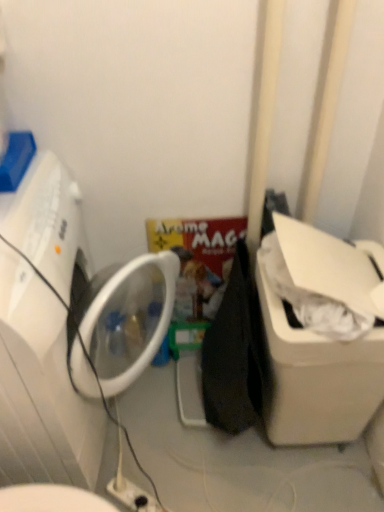
Question: Based on their sizes in the image, would you say white plastic washing machine at left is bigger or smaller than white plastic water cooler at right?

Choices:
 (A) big
 (B) small

Answer: (A)

Question: From the image's perspective, is white plastic washing machine at left located above or below white plastic water cooler at right?

Choices:
 (A) above
 (B) below

Answer: (A)

Question: Estimate the real-world distances between objects in this image. Which object is farther from the white plastic electric outlet at lower center?

Choices:
 (A) white plastic water cooler at right
 (B) white plastic washing machine at left

Answer: (A)

Question: Estimate the real-world distances between objects in this image. Which object is closer to the white plastic electric outlet at lower center?

Choices:
 (A) white plastic water cooler at right
 (B) white plastic washing machine at left

Answer: (B)